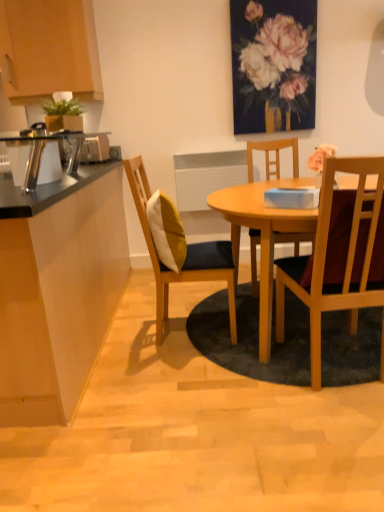
Question: Is wooden chair with cushion at center, arranged as the second chair when viewed from the right, not within yellow fabric pillow at center?

Choices:
 (A) yes
 (B) no

Answer: (A)

Question: Is wooden chair with cushion at center, which is the 1th chair in left-to-right order, positioned with its back to yellow fabric pillow at center?

Choices:
 (A) no
 (B) yes

Answer: (B)

Question: Does wooden chair with cushion at center, which is the 1th chair in left-to-right order, lie in front of yellow fabric pillow at center?

Choices:
 (A) yes
 (B) no

Answer: (A)

Question: Is wooden chair with cushion at center, which is the 1th chair in left-to-right order, bigger than yellow fabric pillow at center?

Choices:
 (A) no
 (B) yes

Answer: (B)

Question: Considering the relative sizes of wooden chair with cushion at center, which is the 1th chair in left-to-right order, and yellow fabric pillow at center in the image provided, is wooden chair with cushion at center, which is the 1th chair in left-to-right order, shorter than yellow fabric pillow at center?

Choices:
 (A) no
 (B) yes

Answer: (A)

Question: Considering the relative sizes of wooden chair with cushion at center, arranged as the second chair when viewed from the right, and yellow fabric pillow at center in the image provided, is wooden chair with cushion at center, arranged as the second chair when viewed from the right, smaller than yellow fabric pillow at center?

Choices:
 (A) no
 (B) yes

Answer: (A)

Question: Considering the relative positions of wooden chair with cushion at center, which is the 1th chair in left-to-right order, and matte floral painting at upper center in the image provided, is wooden chair with cushion at center, which is the 1th chair in left-to-right order, to the right of matte floral painting at upper center from the viewer's perspective?

Choices:
 (A) yes
 (B) no

Answer: (B)

Question: Is wooden chair with cushion at center, which is the 1th chair in left-to-right order, to the left of matte floral painting at upper center from the viewer's perspective?

Choices:
 (A) yes
 (B) no

Answer: (A)

Question: Is matte floral painting at upper center at the back of wooden chair with cushion at center, arranged as the second chair when viewed from the right?

Choices:
 (A) yes
 (B) no

Answer: (B)

Question: From the image's perspective, would you say wooden chair with cushion at center, which is the 1th chair in left-to-right order, is shown under matte floral painting at upper center?

Choices:
 (A) no
 (B) yes

Answer: (B)

Question: From a real-world perspective, is wooden chair with cushion at center, which is the 1th chair in left-to-right order, beneath matte floral painting at upper center?

Choices:
 (A) yes
 (B) no

Answer: (A)

Question: Is wooden chair with cushion at center, arranged as the second chair when viewed from the right, not close to matte floral painting at upper center?

Choices:
 (A) yes
 (B) no

Answer: (A)

Question: Can you confirm if wooden chair with cushion at center, arranged as the second chair when viewed from the right, is smaller than wooden cabinet at upper left?

Choices:
 (A) no
 (B) yes

Answer: (A)